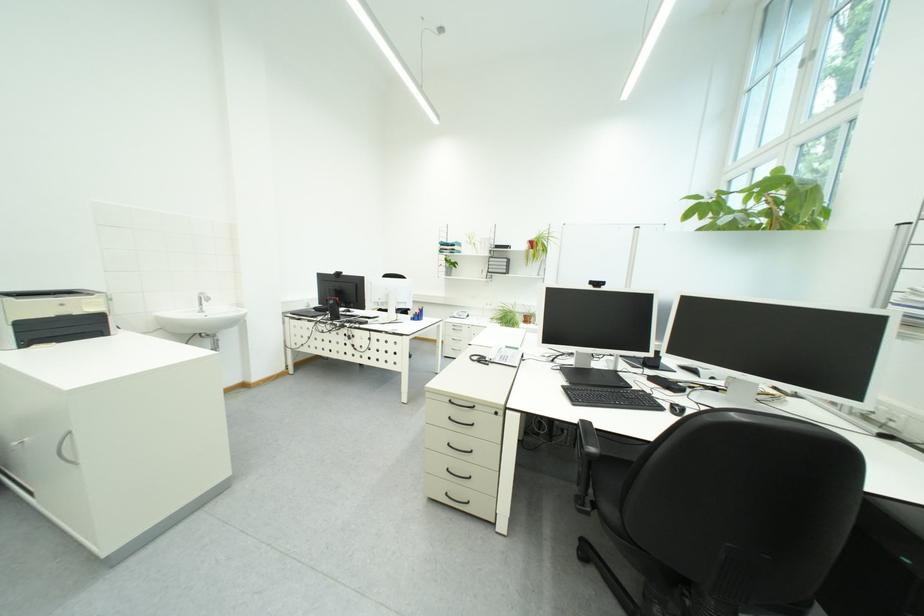
What do you see at coordinates (52, 306) in the screenshot?
I see `a printer scanner lid` at bounding box center [52, 306].